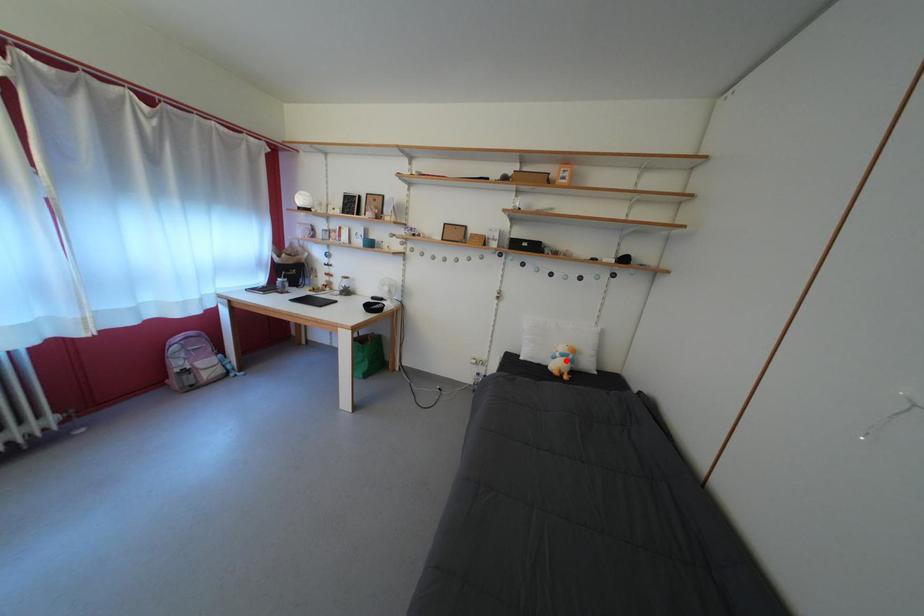
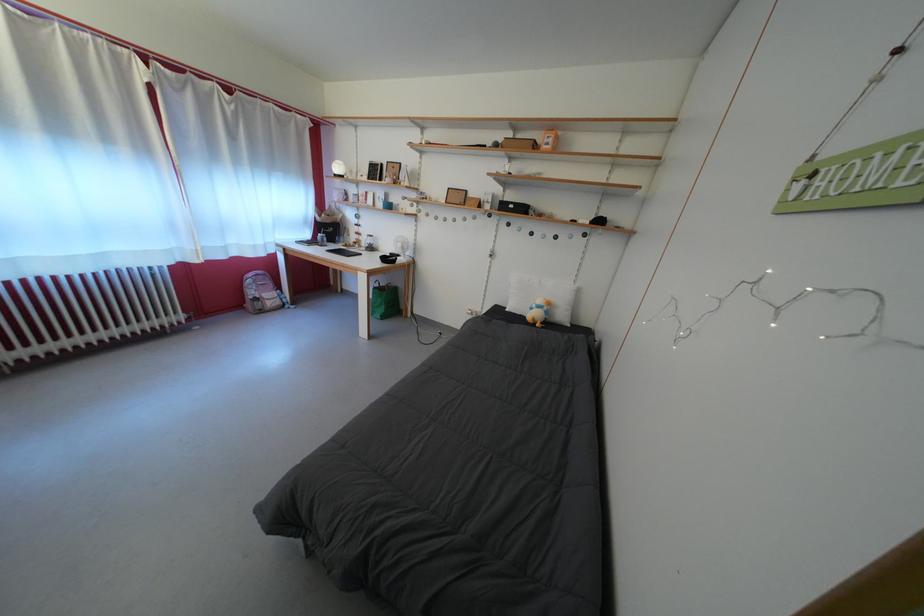
In the second image, find the point that corresponds to the highlighted location in the first image.

(542, 312)